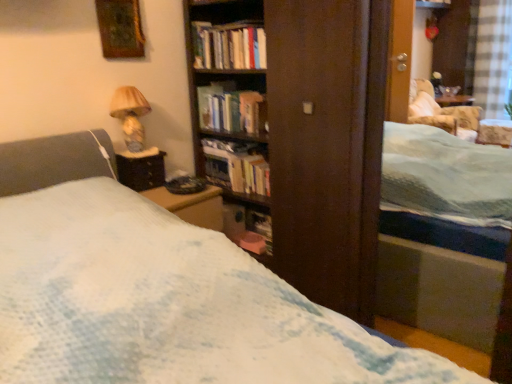
Question: From the image's perspective, is hardcover book at center, which is the first book from bottom to top, located beneath hardcover books at center, the second book positioned from the bottom?

Choices:
 (A) yes
 (B) no

Answer: (A)

Question: Is hardcover book at center, which is the first book from bottom to top, positioned before hardcover books at center, the second book positioned from the bottom?

Choices:
 (A) yes
 (B) no

Answer: (B)

Question: From a real-world perspective, is hardcover book at center, which ranks as the third book in top-to-bottom order, positioned under hardcover books at center, which appears as the 2th book when viewed from the top, based on gravity?

Choices:
 (A) yes
 (B) no

Answer: (A)

Question: Is hardcover book at center, which is the first book from bottom to top, beside hardcover books at center, the second book positioned from the bottom?

Choices:
 (A) yes
 (B) no

Answer: (B)

Question: Considering the relative sizes of hardcover book at center, which ranks as the third book in top-to-bottom order, and hardcover books at center, the second book positioned from the bottom, in the image provided, is hardcover book at center, which ranks as the third book in top-to-bottom order, smaller than hardcover books at center, the second book positioned from the bottom,?

Choices:
 (A) no
 (B) yes

Answer: (A)

Question: Considering the positions of matte beige lampshade at upper left and wooden table at left in the image, is matte beige lampshade at upper left bigger or smaller than wooden table at left?

Choices:
 (A) small
 (B) big

Answer: (B)

Question: From a real-world perspective, is matte beige lampshade at upper left above or below wooden table at left?

Choices:
 (A) below
 (B) above

Answer: (B)

Question: Is matte beige lampshade at upper left inside or outside of wooden table at left?

Choices:
 (A) inside
 (B) outside

Answer: (B)

Question: Considering the positions of matte beige lampshade at upper left and wooden table at left in the image, is matte beige lampshade at upper left taller or shorter than wooden table at left?

Choices:
 (A) short
 (B) tall

Answer: (B)

Question: Relative to hardcover book at center, which ranks as the third book in top-to-bottom order, is wooden table at left in front or behind?

Choices:
 (A) behind
 (B) front

Answer: (B)

Question: Is wooden table at left spatially inside hardcover book at center, which ranks as the third book in top-to-bottom order, or outside of it?

Choices:
 (A) inside
 (B) outside

Answer: (B)

Question: Does point (140, 185) appear closer or farther from the camera than point (240, 170)?

Choices:
 (A) closer
 (B) farther

Answer: (A)

Question: Visually, is wooden table at left positioned to the left or to the right of hardcover book at center, which ranks as the third book in top-to-bottom order?

Choices:
 (A) left
 (B) right

Answer: (A)

Question: Visually, is gold textured frame at upper left positioned to the left or to the right of matte beige lampshade at upper left?

Choices:
 (A) right
 (B) left

Answer: (B)

Question: Do you think gold textured frame at upper left is within matte beige lampshade at upper left, or outside of it?

Choices:
 (A) outside
 (B) inside

Answer: (A)